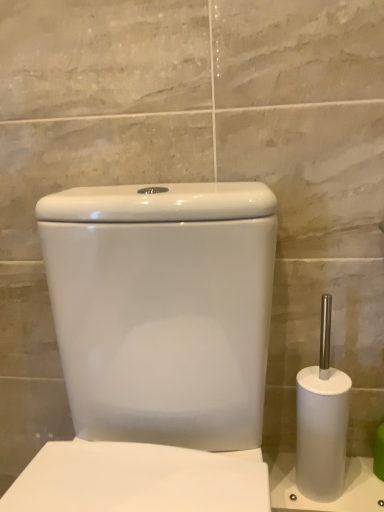
Question: Should I look upward or downward to see white glossy toilet at center?

Choices:
 (A) down
 (B) up

Answer: (A)